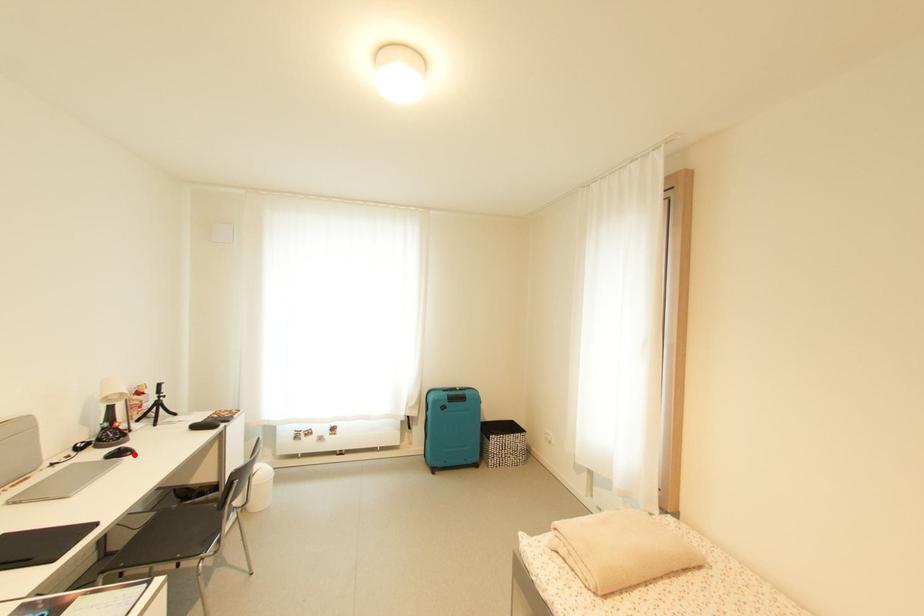
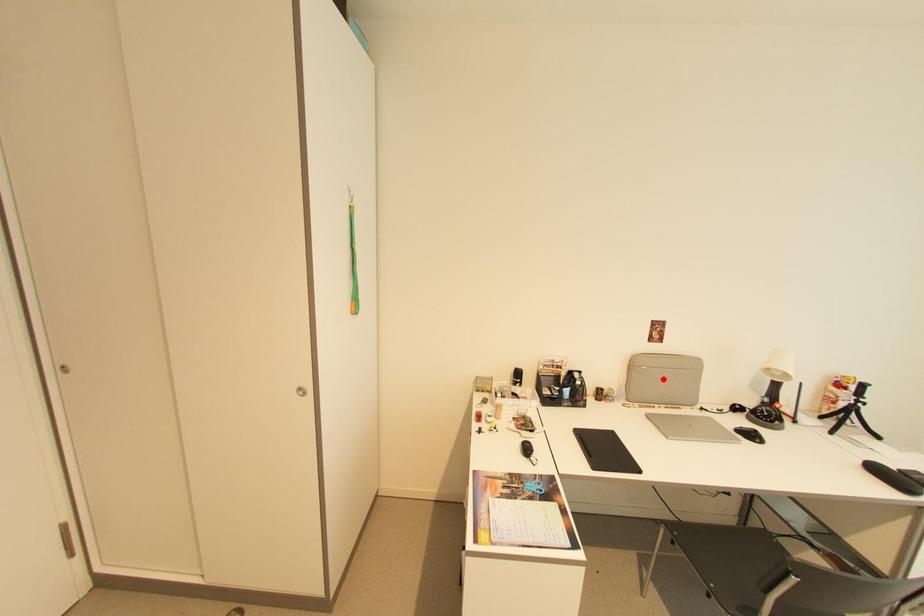
I am providing you with two images of the same scene from different viewpoints. A red point is marked on the first image and another point is marked on the second image. Does the point marked in image1 correspond to the same location as the one in image2?

No